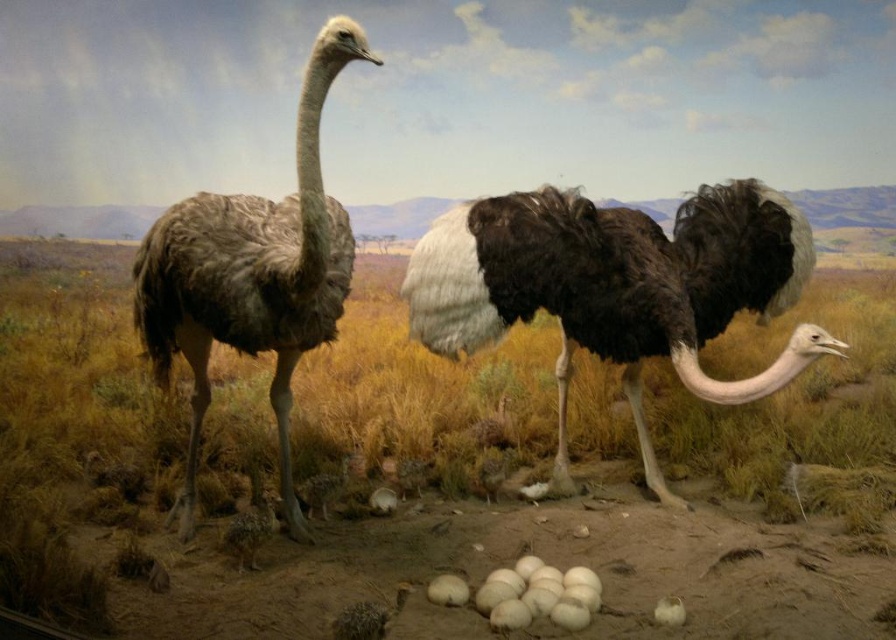
You are standing in front of the museum exhibit and see two points marked in the image. Which point is closer to you, point [890,328] or point [722,220]?

Point [890,328] is closer to you because it is further to the viewer than point [722,220].

You are an art student observing the museum exhibit. You notice the brown feathered ostrich at left and the dark brown feathers at center. Which object is closer to the glass barrier?

The dark brown feathers at center are closer to the glass barrier because the brown feathered ostrich at left is behind them.